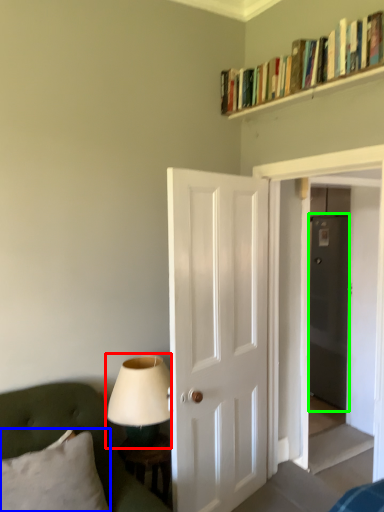
Question: Considering the real-world distances, which object is closest to table lamp (highlighted by a red box)? pillow (highlighted by a blue box) or glass door (highlighted by a green box).

Choices:
 (A) pillow
 (B) glass door

Answer: (A)